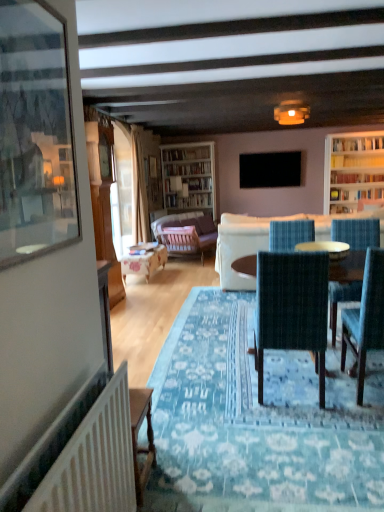
This screenshot has height=512, width=384. What are the coordinates of `vacant area to the right of wooden desk at lower left` in the screenshot? It's located at (177, 480).